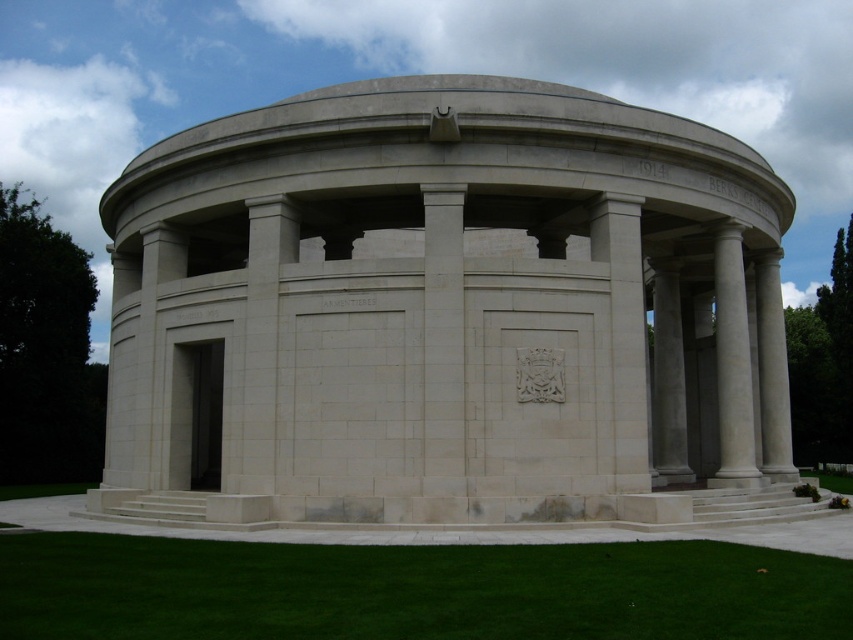
You are standing at the point marked as point (437,314) in the image. What structure are you facing directly?

The structure you are facing directly at point (437,314) is the white stone gazebo at center.

You are a landscape architect designing a garden around the monument. You need to place a 2.5 meter wide statue between the white marble column at right and the green grass at lower right. Can you fit the statue between them?

The white marble column at right is narrower than the green grass at lower right. Since the statue is 2.5 meters wide, you need to check the space between them. However, the description only states the column is narrower than the grass area but does not provide exact measurements. Without knowing the actual width of the column or the grass area, it is impossible to determine if the statue will fit.

You are standing in a park and see the white stone gazebo at center. If you want to take a photo of it from a distance where it appears small but still recognizable, would 27.39 meters be a suitable distance?

The white stone gazebo at center is 27.39 meters away from viewer. Yes, this distance would allow the gazebo to appear small but still recognizable in the photo.